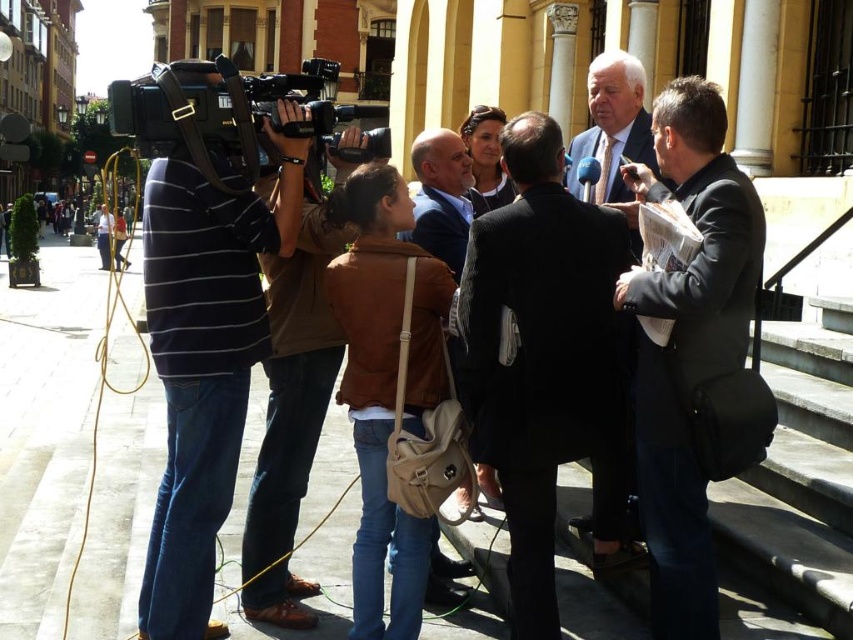
Question: Does gray concrete stairs at lower right appear on the left side of black plastic camera at left?

Choices:
 (A) yes
 (B) no

Answer: (B)

Question: Can you confirm if gray concrete stairs at lower right is smaller than black plastic camera at left?

Choices:
 (A) yes
 (B) no

Answer: (A)

Question: Observing the image, what is the correct spatial positioning of gray concrete stairs at lower right in reference to black plastic camera at left?

Choices:
 (A) below
 (B) above

Answer: (A)

Question: Among these points, which one is farthest from the camera?

Choices:
 (A) (830, 392)
 (B) (454, 196)
 (C) (225, 120)
 (D) (148, 284)

Answer: (B)

Question: Which of these objects is positioned farthest from the light brown leather jacket at center?

Choices:
 (A) brown leather jacket at center
 (B) matte black camera at left

Answer: (B)

Question: Which object appears farthest from the camera in this image?

Choices:
 (A) black plastic camera at left
 (B) leather jacket at center
 (C) brown leather jacket at center
 (D) black suit at center

Answer: (B)